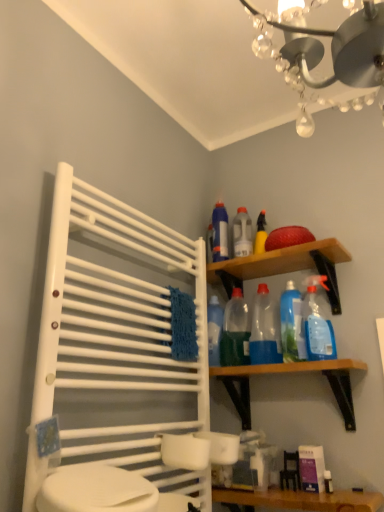
This screenshot has width=384, height=512. Find the location of `free spot below wooden shelf at upper right, which ranks as the 2th shelf in top-to-bottom order (from a real-world perspective)`. free spot below wooden shelf at upper right, which ranks as the 2th shelf in top-to-bottom order (from a real-world perspective) is located at coordinates (312, 494).